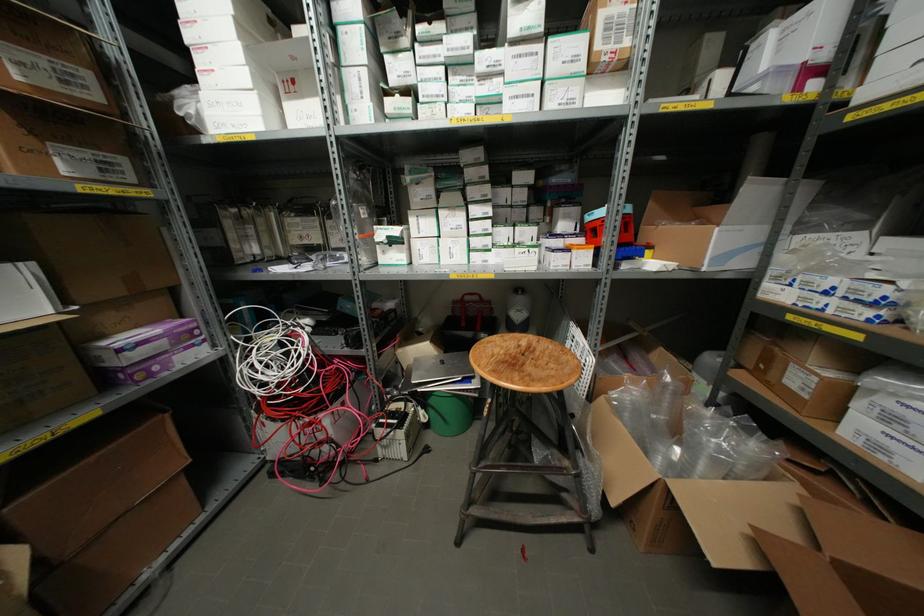
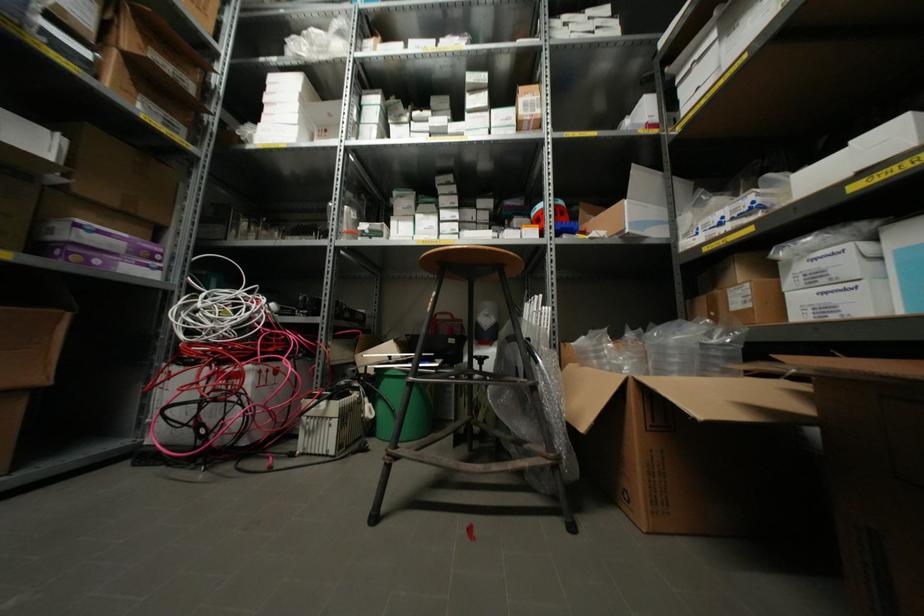
Question: The first image is from the beginning of the video and the second image is from the end. How did the camera likely rotate when shooting the video?

Choices:
 (A) Left
 (B) Right
 (C) Up
 (D) Down

Answer: (C)